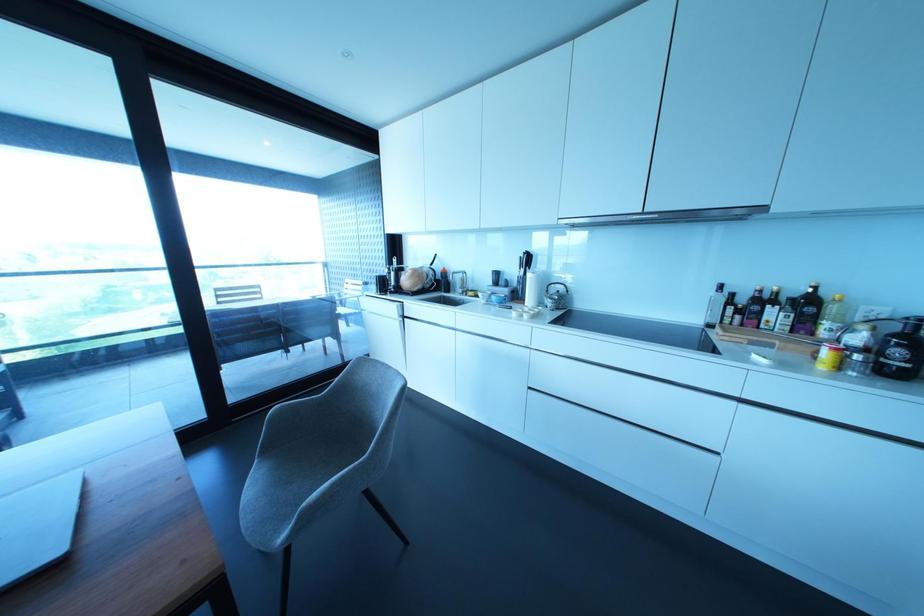
Locate an element on the screen. This screenshot has height=616, width=924. clear plastic bottle is located at coordinates (832, 318).